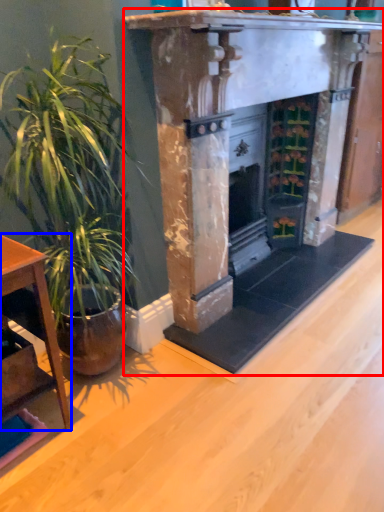
Question: Which point is closer to the camera, fireplace (highlighted by a red box) or table (highlighted by a blue box)?

Choices:
 (A) fireplace
 (B) table

Answer: (B)